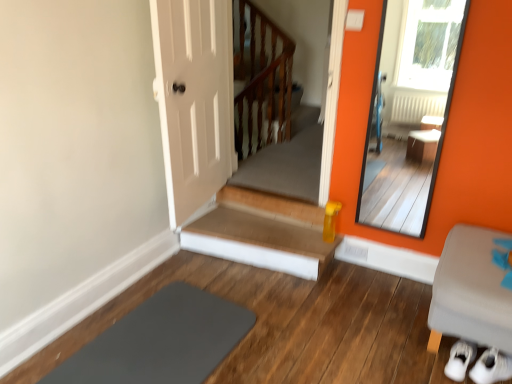
Locate an element on the screen. The image size is (512, 384). slate at lower left is located at coordinates (160, 341).

In order to click on wooden at upper center in this screenshot , I will do `click(262, 79)`.

This screenshot has width=512, height=384. I want to click on smooth orange mirror at right, so click(409, 112).

Locate an element on the screen. slate at lower left is located at coordinates (160, 341).

From the picture: Which is nearer, (401,133) or (129,312)?

Point (401,133) is farther from the camera than point (129,312).

Is smooth orange mirror at right in contact with slate at lower left?

smooth orange mirror at right and slate at lower left are not in contact.

Which object is more forward, smooth orange mirror at right or slate at lower left?

slate at lower left is in front.

Consider the image. From a real-world perspective, is smooth orange mirror at right positioned over slate at lower left based on gravity?

Yes.

Between gray fabric ottoman at lower right and smooth orange mirror at right, which one appears on the right side from the viewer's perspective?

gray fabric ottoman at lower right is more to the right.

Which object is further away from the camera, gray fabric ottoman at lower right or smooth orange mirror at right?

smooth orange mirror at right.

How different are the orientations of gray fabric ottoman at lower right and smooth orange mirror at right in degrees?

0.0952 degrees separate the facing orientations of gray fabric ottoman at lower right and smooth orange mirror at right.

Is gray fabric ottoman at lower right looking in the opposite direction of smooth orange mirror at right?

No, smooth orange mirror at right is not at the back of gray fabric ottoman at lower right.

I want to click on stairs above the gray fabric ottoman at lower right (from the image's perspective), so click(x=263, y=232).

Based on the photo, measure the distance between gray fabric ottoman at lower right and wooden stairs at center.

gray fabric ottoman at lower right and wooden stairs at center are 1.02 meters apart from each other.

Is gray fabric ottoman at lower right beside wooden stairs at center?

There is a gap between gray fabric ottoman at lower right and wooden stairs at center.

From the picture: Is gray fabric ottoman at lower right outside of wooden stairs at center?

gray fabric ottoman at lower right lies outside wooden stairs at center's area.

In the scene shown: Could you tell me if smooth orange mirror at right is turned towards wooden at upper center?

No, smooth orange mirror at right does not turn towards wooden at upper center.

Does point (436, 62) come farther from viewer compared to point (289, 50)?

Yes.

Is smooth orange mirror at right inside or outside of wooden at upper center?

smooth orange mirror at right is not inside wooden at upper center, it's outside.

Which is more to the right, wooden stairs at center or gray fabric ottoman at lower right?

Positioned to the right is gray fabric ottoman at lower right.

Looking at this image, who is smaller, wooden stairs at center or gray fabric ottoman at lower right?

wooden stairs at center is smaller.

Between wooden stairs at center and gray fabric ottoman at lower right, which one is positioned in front?

gray fabric ottoman at lower right is closer to the camera.

In terms of height, does wooden stairs at center look taller or shorter compared to gray fabric ottoman at lower right?

Clearly, wooden stairs at center is shorter compared to gray fabric ottoman at lower right.

Is point (368, 216) more distant than point (484, 323)?

Yes.

In the scene shown: Is smooth orange mirror at right located outside gray fabric ottoman at lower right?

smooth orange mirror at right is positioned outside gray fabric ottoman at lower right.

From the image's perspective, would you say smooth orange mirror at right is shown under gray fabric ottoman at lower right?

No.

Where is `furniture that appears below the smooth orange mirror at right (from the image's perspective)`? This screenshot has width=512, height=384. furniture that appears below the smooth orange mirror at right (from the image's perspective) is located at coordinates (470, 291).

Looking at this image, in terms of width, does wooden stairs at center look wider or thinner when compared to wooden at upper center?

In the image, wooden stairs at center appears to be more narrow than wooden at upper center.

Is the surface of wooden stairs at center in direct contact with wooden at upper center?

No, wooden stairs at center is not making contact with wooden at upper center.

From the image's perspective, is wooden stairs at center on top of wooden at upper center?

No, from the image's perspective, wooden stairs at center is not on top of wooden at upper center.

Identify the location of slate beneath the smooth orange mirror at right (from a real-world perspective). Image resolution: width=512 pixels, height=384 pixels. (160, 341).

Image resolution: width=512 pixels, height=384 pixels. I want to click on mirror on the left of gray fabric ottoman at lower right, so click(409, 112).

Based on their spatial positions, is wooden at upper center or slate at lower left further from wooden stairs at center?

The object further to wooden stairs at center is wooden at upper center.

Considering their positions, is smooth orange mirror at right positioned further to slate at lower left than gray fabric ottoman at lower right?

smooth orange mirror at right.

From the image, which object appears to be farther from smooth orange mirror at right, wooden stairs at center or wooden at upper center?

Among the two, wooden stairs at center is located further to smooth orange mirror at right.

Which object lies nearer to the anchor point slate at lower left, wooden at upper center or smooth orange mirror at right?

Based on the image, wooden at upper center appears to be nearer to slate at lower left.

Which object lies further to the anchor point gray fabric ottoman at lower right, wooden at upper center or slate at lower left?

wooden at upper center.

Looking at the image, which one is located further to wooden stairs at center, smooth orange mirror at right or slate at lower left?

smooth orange mirror at right is further to wooden stairs at center.

Based on their spatial positions, is wooden at upper center or gray fabric ottoman at lower right closer to slate at lower left?

gray fabric ottoman at lower right lies closer to slate at lower left than the other object.

From the image, which object appears to be nearer to smooth orange mirror at right, wooden at upper center or gray fabric ottoman at lower right?

wooden at upper center.

I want to click on stairs between slate at lower left and gray fabric ottoman at lower right from left to right, so click(x=263, y=232).

Locate an element on the screen. This screenshot has height=384, width=512. mirror between slate at lower left and wooden at upper center from front to back is located at coordinates pyautogui.click(x=409, y=112).

Locate an element on the screen. The image size is (512, 384). mirror located between gray fabric ottoman at lower right and wooden at upper center in the depth direction is located at coordinates (409, 112).

The image size is (512, 384). I want to click on stairs between slate at lower left and wooden at upper center along the z-axis, so pyautogui.click(x=263, y=232).